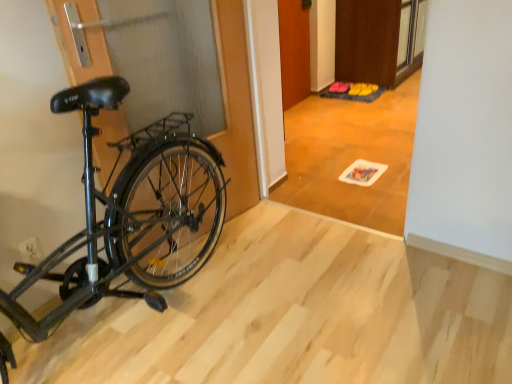
Question: From the image's perspective, is brown matte door at upper center, which is the 1th door from right to left, on white plastic power plug at lower left?

Choices:
 (A) yes
 (B) no

Answer: (A)

Question: Can you confirm if brown matte door at upper center, placed as the second door when sorted from left to right, is positioned to the right of white plastic power plug at lower left?

Choices:
 (A) no
 (B) yes

Answer: (B)

Question: Is brown matte door at upper center, placed as the second door when sorted from left to right, outside white plastic power plug at lower left?

Choices:
 (A) yes
 (B) no

Answer: (A)

Question: Considering the relative sizes of brown matte door at upper center, which is the 1th door from right to left, and white plastic power plug at lower left in the image provided, is brown matte door at upper center, which is the 1th door from right to left, smaller than white plastic power plug at lower left?

Choices:
 (A) yes
 (B) no

Answer: (B)

Question: Is brown matte door at upper center, which is the 1th door from right to left, aimed at white plastic power plug at lower left?

Choices:
 (A) no
 (B) yes

Answer: (A)

Question: From a real-world perspective, relative to wooden door at center, which is the first door in left-to-right order, is wooden tile floor at center vertically above or below?

Choices:
 (A) below
 (B) above

Answer: (B)

Question: Considering the positions of wooden tile floor at center and wooden door at center, the second door when ordered from right to left, in the image, is wooden tile floor at center wider or thinner than wooden door at center, the second door when ordered from right to left,?

Choices:
 (A) wide
 (B) thin

Answer: (A)

Question: Choose the correct answer: Is wooden tile floor at center inside wooden door at center, the second door when ordered from right to left, or outside it?

Choices:
 (A) outside
 (B) inside

Answer: (A)

Question: In the image, is wooden tile floor at center on the left side or the right side of wooden door at center, the second door when ordered from right to left?

Choices:
 (A) left
 (B) right

Answer: (B)

Question: Is point (395, 190) closer or farther from the camera than point (361, 94)?

Choices:
 (A) farther
 (B) closer

Answer: (B)

Question: Based on their positions, is wooden tile floor at center located to the left or right of yellow fabric walking shoe at center, the 2th walking shoe viewed from the left?

Choices:
 (A) left
 (B) right

Answer: (A)

Question: Considering their positions, is wooden tile floor at center located in front of or behind yellow fabric walking shoe at center, the 2th walking shoe viewed from the left?

Choices:
 (A) front
 (B) behind

Answer: (A)

Question: From the image's perspective, relative to yellow fabric walking shoe at center, the 2th walking shoe viewed from the left, is wooden tile floor at center above or below?

Choices:
 (A) below
 (B) above

Answer: (A)

Question: In the image, is wooden door at center, which is the first door in left-to-right order, positioned in front of or behind wooden tile floor at center?

Choices:
 (A) front
 (B) behind

Answer: (B)

Question: Looking at the image, does wooden door at center, the second door when ordered from right to left, seem bigger or smaller compared to wooden tile floor at center?

Choices:
 (A) small
 (B) big

Answer: (A)